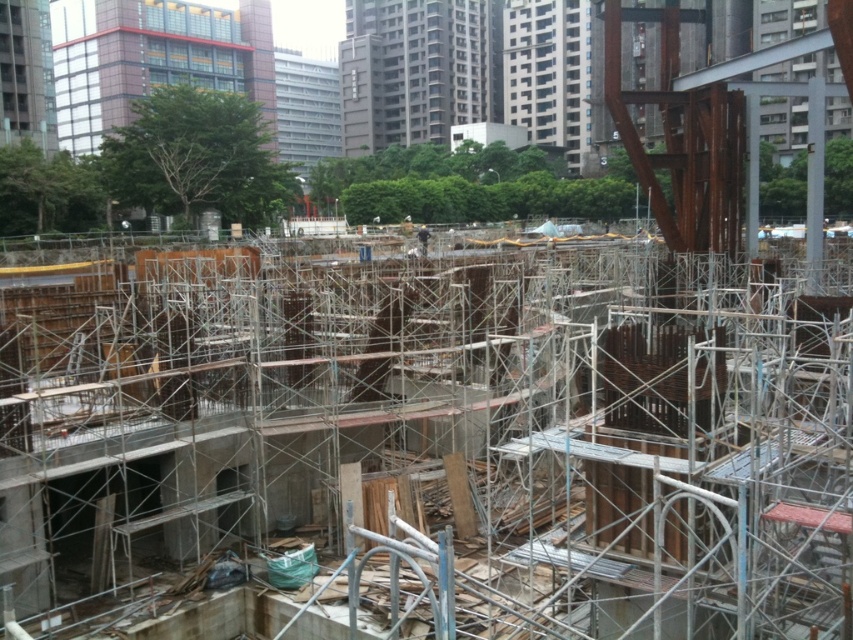
Image resolution: width=853 pixels, height=640 pixels. Describe the element at coordinates (440, 442) in the screenshot. I see `metal scaffolding at center` at that location.

Does metal scaffolding at center come behind dark blue uniform at center?

No.

Locate an element on the screen. metal scaffolding at center is located at coordinates (440, 442).